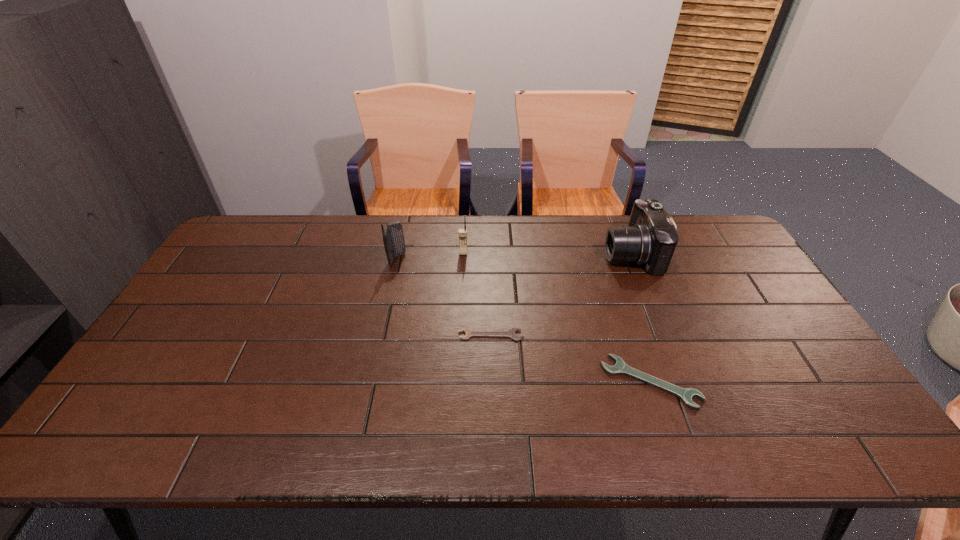
At what (x,y) coordinates should I click in order to perform the action: click on the left cellular telephone. Please return your answer as a coordinate pair (x, y). Looking at the image, I should click on (393, 238).

Find the location of a particular element. The width and height of the screenshot is (960, 540). camera is located at coordinates (650, 239).

Where is `the right cellular telephone`? Image resolution: width=960 pixels, height=540 pixels. the right cellular telephone is located at coordinates (462, 232).

This screenshot has width=960, height=540. I want to click on the right wrench, so click(685, 394).

I want to click on the nearer wrench, so click(685, 394).

Where is `the left wrench`? the left wrench is located at coordinates (510, 333).

In order to click on the shortest object in this screenshot , I will do `click(510, 333)`.

The width and height of the screenshot is (960, 540). What are the coordinates of `free location located on the keyboard of the leftmost object` in the screenshot? It's located at (498, 259).

Identify the location of blank area located on the lens of the camera. (560, 253).

Where is `free space located on the lens of the camera`? This screenshot has width=960, height=540. free space located on the lens of the camera is located at coordinates (544, 253).